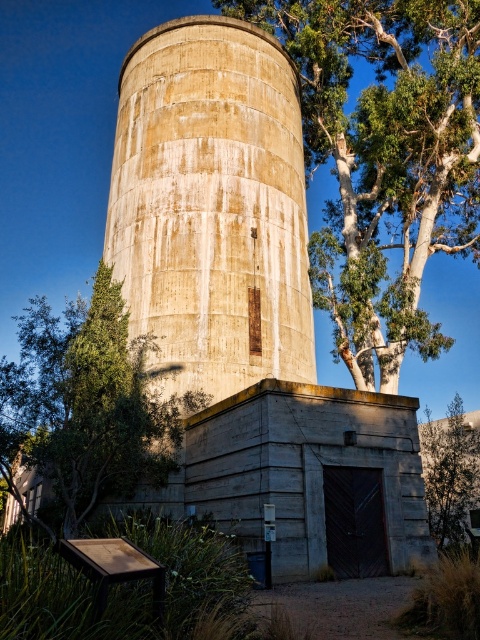
Can you confirm if concrete tower at center is positioned to the right of green leafy tree at lower right?

No, concrete tower at center is not to the right of green leafy tree at lower right.

This screenshot has width=480, height=640. Identify the location of concrete tower at center. (212, 208).

Does green leafy tree at center appear on the right side of green leafy tree at lower left?

Yes, green leafy tree at center is to the right of green leafy tree at lower left.

Locate an element on the screen. This screenshot has height=640, width=480. green leafy tree at center is located at coordinates (384, 160).

At what (x,y) coordinates should I click in order to perform the action: click on green leafy tree at center. Please return your answer as a coordinate pair (x, y). Looking at the image, I should click on (384, 160).

You are a GUI agent. You are given a task and a screenshot of the screen. Output one action in this format:
    pyautogui.click(x=<x>, y=<y>)
    Task: Click on the green leafy tree at center
    
    Given the screenshot: What is the action you would take?
    pyautogui.click(x=384, y=160)

Which of these two, concrete tower at center or green leafy tree at center, stands shorter?

Standing shorter between the two is concrete tower at center.

Is the position of concrete tower at center more distant than that of green leafy tree at center?

No, it is in front of green leafy tree at center.

The height and width of the screenshot is (640, 480). In order to click on concrete tower at center in this screenshot , I will do `click(212, 208)`.